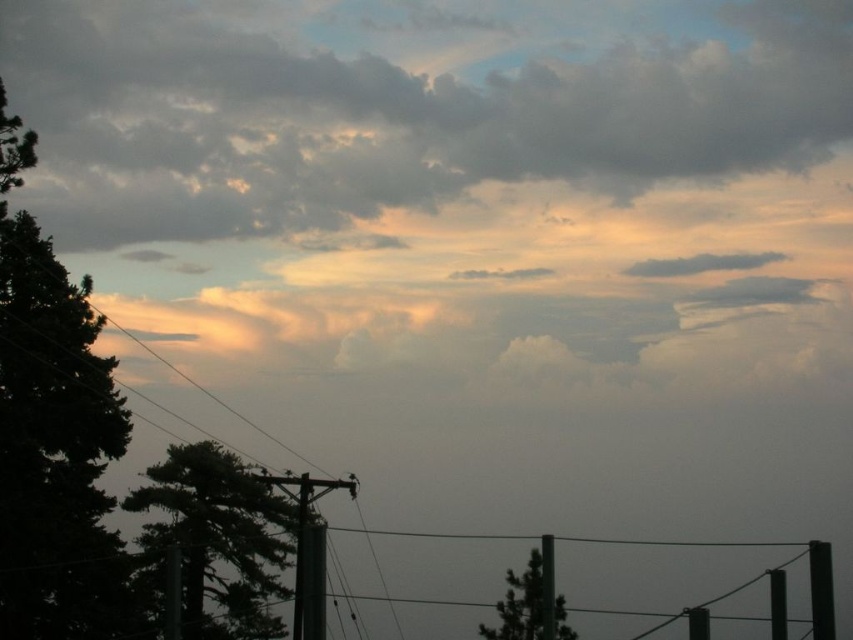
Image resolution: width=853 pixels, height=640 pixels. What do you see at coordinates (305, 524) in the screenshot? I see `smooth gray pole at center` at bounding box center [305, 524].

Locate an element on the screen. smooth gray pole at center is located at coordinates (305, 524).

At what (x,y) coordinates should I click in order to perform the action: click on smooth gray pole at center. Please return your answer as a coordinate pair (x, y). This screenshot has width=853, height=640. Looking at the image, I should click on (305, 524).

Is point (274, 481) closer to camera compared to point (827, 618)?

No, (274, 481) is behind (827, 618).

Which is below, smooth gray pole at center or black matte pole at right?

smooth gray pole at center is below.

Locate an element on the screen. smooth gray pole at center is located at coordinates (305, 524).

Based on the photo, can you confirm if cloudy sky at upper center is smaller than black metal pole at lower right?

No.

Is point (55, 177) positioned after point (776, 627)?

Yes, point (55, 177) is farther from viewer.

Which is behind, point (679, 51) or point (776, 593)?

The point (679, 51) is behind.

Identify the location of cloudy sky at upper center. This screenshot has width=853, height=640. (393, 109).